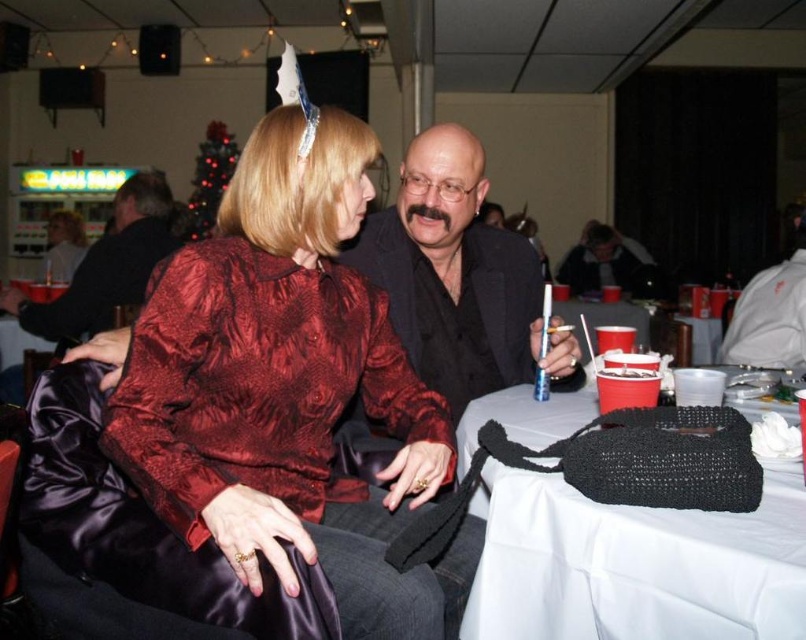
Is matte black jacket at center shorter than dark gray sweater at center?

No.

Can you confirm if matte black jacket at center is positioned below dark gray sweater at center?

Correct, matte black jacket at center is located below dark gray sweater at center.

Is point (576, 344) positioned before point (566, 268)?

Yes.

Locate an element on the screen. matte black jacket at center is located at coordinates (451, 273).

Is shiny red blouse at center smaller than black knitted bag at lower right?

No, shiny red blouse at center is not smaller than black knitted bag at lower right.

Between shiny red blouse at center and black knitted bag at lower right, which one appears on the right side from the viewer's perspective?

Positioned to the right is black knitted bag at lower right.

The width and height of the screenshot is (806, 640). Describe the element at coordinates (293, 385) in the screenshot. I see `shiny red blouse at center` at that location.

Identify the location of shiny red blouse at center. (293, 385).

Does black knitted bag at lower right have a larger size compared to dark gray sweater at center?

Actually, black knitted bag at lower right might be smaller than dark gray sweater at center.

Locate an element on the screen. This screenshot has width=806, height=640. black knitted bag at lower right is located at coordinates (634, 563).

Measure the distance between black knitted bag at lower right and camera.

black knitted bag at lower right and camera are 75.12 centimeters apart from each other.

The image size is (806, 640). In order to click on black knitted bag at lower right in this screenshot , I will do `click(634, 563)`.